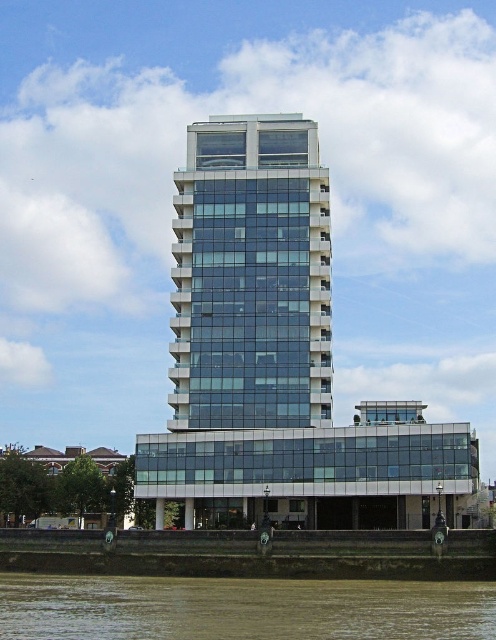
Question: Based on their relative distances, which object is farther from the brown sedimentary river at lower center?

Choices:
 (A) clear glass building at center
 (B) transparent glass building at center

Answer: (B)

Question: Which of the following is the closest to the observer?

Choices:
 (A) (183, 374)
 (B) (280, 460)
 (C) (493, 592)

Answer: (C)

Question: Can you confirm if clear glass building at center is positioned above transparent glass building at center?

Choices:
 (A) no
 (B) yes

Answer: (A)

Question: Does transparent glass building at center appear over brown sedimentary river at lower center?

Choices:
 (A) no
 (B) yes

Answer: (B)

Question: Does clear glass building at center appear on the left side of transparent glass building at center?

Choices:
 (A) no
 (B) yes

Answer: (A)

Question: Which is nearer to the brown sedimentary river at lower center?

Choices:
 (A) clear glass building at center
 (B) transparent glass building at center

Answer: (A)